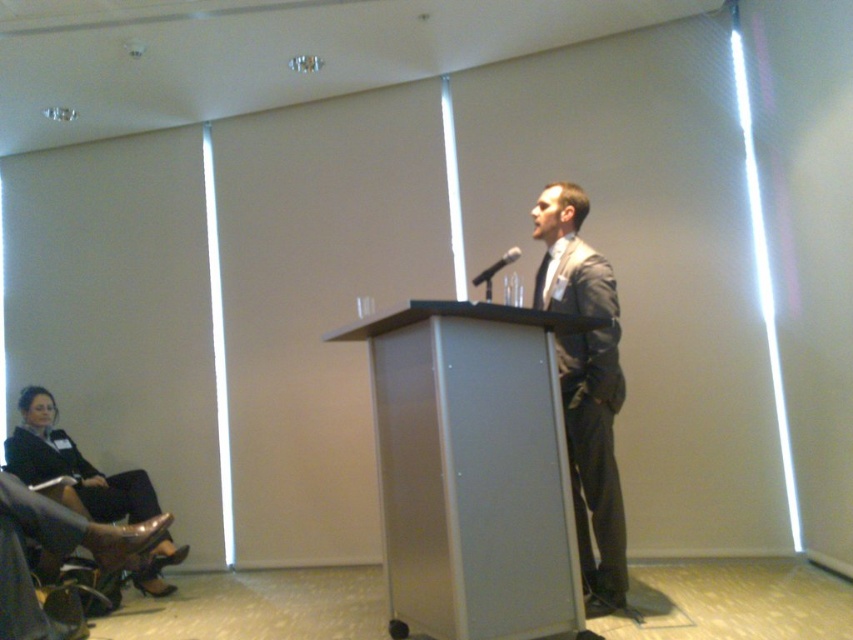
Question: Which point appears farthest from the camera in this image?

Choices:
 (A) (547, 266)
 (B) (550, 595)

Answer: (A)

Question: Which point is farther from the camera taking this photo?

Choices:
 (A) (498, 259)
 (B) (434, 520)
 (C) (608, 448)
 (D) (74, 493)

Answer: (A)

Question: Which object appears closest to the camera in this image?

Choices:
 (A) silver metallic podium at center
 (B) black matte microphone at center

Answer: (A)

Question: Is the position of matte gray suit at center less distant than that of black matte microphone at center?

Choices:
 (A) yes
 (B) no

Answer: (A)

Question: Can you confirm if silver metallic podium at center is smaller than matte black suit at lower left?

Choices:
 (A) no
 (B) yes

Answer: (A)

Question: Is silver metallic podium at center positioned before matte gray suit at center?

Choices:
 (A) no
 (B) yes

Answer: (B)